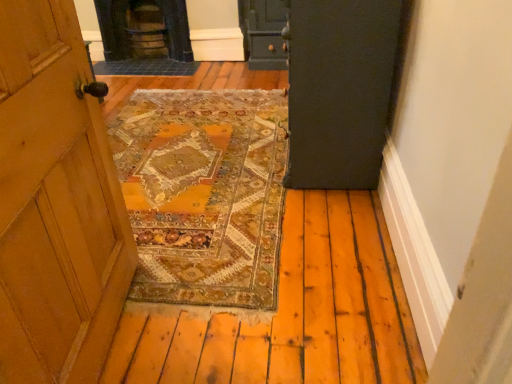
This screenshot has width=512, height=384. I want to click on matte dark green door at center-right, so click(x=341, y=89).

The width and height of the screenshot is (512, 384). Describe the element at coordinates (341, 89) in the screenshot. I see `matte dark green door at center-right` at that location.

In order to face dark brown stone stove at upper center, should I rotate leftwards or rightwards?

Rotate left and turn 14.310 degrees.

In order to click on dark brown stone stove at upper center in this screenshot , I will do `click(144, 29)`.

What is the approximate height of dark brown stone stove at upper center?

The height of dark brown stone stove at upper center is 24.61 inches.

Describe the element at coordinates (144, 29) in the screenshot. The height and width of the screenshot is (384, 512). I see `dark brown stone stove at upper center` at that location.

At what (x,y) coordinates should I click in order to perform the action: click on matte dark green door at center-right. Please return your answer as a coordinate pair (x, y). Looking at the image, I should click on (341, 89).

Considering the positions of objects dark brown stone stove at upper center and matte dark green door at center-right in the image provided, who is more to the left, dark brown stone stove at upper center or matte dark green door at center-right?

dark brown stone stove at upper center is more to the left.

Between dark brown stone stove at upper center and matte dark green door at center-right, which one is positioned behind?

dark brown stone stove at upper center is more distant.

Does point (153, 12) appear closer or farther from the camera than point (293, 40)?

Point (153, 12) appears to be farther away from the viewer than point (293, 40).

From the image's perspective, is dark brown stone stove at upper center under matte dark green door at center-right?

No, from the image's perspective, dark brown stone stove at upper center is not below matte dark green door at center-right.

Based on the photo, from a real-world perspective, is dark brown stone stove at upper center positioned above or below matte dark green door at center-right?

From a real-world perspective, dark brown stone stove at upper center is physically below matte dark green door at center-right.

Between dark brown stone stove at upper center and matte dark green door at center-right, which one has larger width?

With larger width is matte dark green door at center-right.

Considering the relative sizes of dark brown stone stove at upper center and matte dark green door at center-right in the image provided, is dark brown stone stove at upper center shorter than matte dark green door at center-right?

Indeed, dark brown stone stove at upper center has a lesser height compared to matte dark green door at center-right.

Which of these two, dark brown stone stove at upper center or matte dark green door at center-right, is bigger?

matte dark green door at center-right.

In the scene shown: Is dark brown stone stove at upper center located outside matte dark green door at center-right?

Yes, dark brown stone stove at upper center is outside of matte dark green door at center-right.

Does dark brown stone stove at upper center touch matte dark green door at center-right?

dark brown stone stove at upper center is not next to matte dark green door at center-right, and they're not touching.

Is dark brown stone stove at upper center positioned with its back to matte dark green door at center-right?

No, dark brown stone stove at upper center's orientation is not away from matte dark green door at center-right.

Measure the distance from dark brown stone stove at upper center to matte dark green door at center-right.

dark brown stone stove at upper center is 2.77 meters away from matte dark green door at center-right.

This screenshot has height=384, width=512. What are the coordinates of `stove behind the matte dark green door at center-right` in the screenshot? It's located at (144, 29).

Considering the relative positions of matte dark green door at center-right and dark brown stone stove at upper center in the image provided, is matte dark green door at center-right to the left or to the right of dark brown stone stove at upper center?

From the image, it's evident that matte dark green door at center-right is to the right of dark brown stone stove at upper center.

Is the depth of matte dark green door at center-right less than that of dark brown stone stove at upper center?

That is True.

Does point (294, 120) appear closer or farther from the camera than point (125, 8)?

Point (294, 120) is closer to the camera than point (125, 8).

From the image's perspective, is matte dark green door at center-right beneath dark brown stone stove at upper center?

Yes, from the image's perspective, matte dark green door at center-right is below dark brown stone stove at upper center.

From a real-world perspective, between matte dark green door at center-right and dark brown stone stove at upper center, who is vertically higher?

matte dark green door at center-right is physically above.

Does matte dark green door at center-right have a greater width compared to dark brown stone stove at upper center?

Yes, matte dark green door at center-right is wider than dark brown stone stove at upper center.

Considering the sizes of matte dark green door at center-right and dark brown stone stove at upper center in the image, is matte dark green door at center-right taller or shorter than dark brown stone stove at upper center?

In the image, matte dark green door at center-right appears to be taller than dark brown stone stove at upper center.

Does matte dark green door at center-right have a larger size compared to dark brown stone stove at upper center?

Correct, matte dark green door at center-right is larger in size than dark brown stone stove at upper center.

Is matte dark green door at center-right inside or outside of dark brown stone stove at upper center?

matte dark green door at center-right lies outside dark brown stone stove at upper center.

Is the surface of matte dark green door at center-right in direct contact with dark brown stone stove at upper center?

matte dark green door at center-right and dark brown stone stove at upper center are not in contact.

Is matte dark green door at center-right aimed at dark brown stone stove at upper center?

No, matte dark green door at center-right is not aimed at dark brown stone stove at upper center.

What's the angular difference between matte dark green door at center-right and dark brown stone stove at upper center's facing directions?

The angular difference between matte dark green door at center-right and dark brown stone stove at upper center is 90.4 degrees.

You are a GUI agent. You are given a task and a screenshot of the screen. Output one action in this format:
    pyautogui.click(x=<x>, y=<y>)
    Task: Click on the door that is on the right side of dark brown stone stove at upper center
    
    Given the screenshot: What is the action you would take?
    point(341,89)

I want to click on stove below the matte dark green door at center-right (from a real-world perspective), so click(x=144, y=29).

Locate an element on the screen. This screenshot has height=384, width=512. stove on the left of matte dark green door at center-right is located at coordinates 144,29.